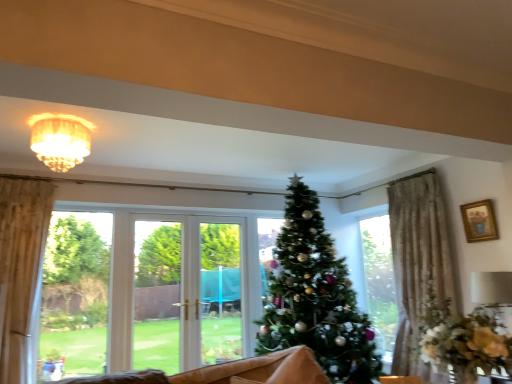
Question: Can you confirm if gold-framed picture at upper right is positioned to the left of green matte christmas tree at center?

Choices:
 (A) no
 (B) yes

Answer: (A)

Question: Is gold-framed picture at upper right aimed at green matte christmas tree at center?

Choices:
 (A) yes
 (B) no

Answer: (B)

Question: Is gold-framed picture at upper right smaller than green matte christmas tree at center?

Choices:
 (A) yes
 (B) no

Answer: (A)

Question: Does gold-framed picture at upper right have a lesser width compared to green matte christmas tree at center?

Choices:
 (A) yes
 (B) no

Answer: (A)

Question: Is gold-framed picture at upper right oriented away from green matte christmas tree at center?

Choices:
 (A) yes
 (B) no

Answer: (B)

Question: From a real-world perspective, is gold-framed picture at upper right below green matte christmas tree at center?

Choices:
 (A) no
 (B) yes

Answer: (A)

Question: Is wooden coffee table at lower center smaller than matte gold chandelier at upper center?

Choices:
 (A) no
 (B) yes

Answer: (B)

Question: Is wooden coffee table at lower center shorter than matte gold chandelier at upper center?

Choices:
 (A) yes
 (B) no

Answer: (A)

Question: Is wooden coffee table at lower center bigger than matte gold chandelier at upper center?

Choices:
 (A) no
 (B) yes

Answer: (A)

Question: Does wooden coffee table at lower center have a greater width compared to matte gold chandelier at upper center?

Choices:
 (A) yes
 (B) no

Answer: (B)

Question: Does wooden coffee table at lower center appear on the left side of matte gold chandelier at upper center?

Choices:
 (A) no
 (B) yes

Answer: (A)

Question: From a real-world perspective, is wooden coffee table at lower center located beneath matte gold chandelier at upper center?

Choices:
 (A) yes
 (B) no

Answer: (A)

Question: From the image's perspective, does wooden coffee table at lower center appear lower than gold-framed picture at upper right?

Choices:
 (A) no
 (B) yes

Answer: (B)